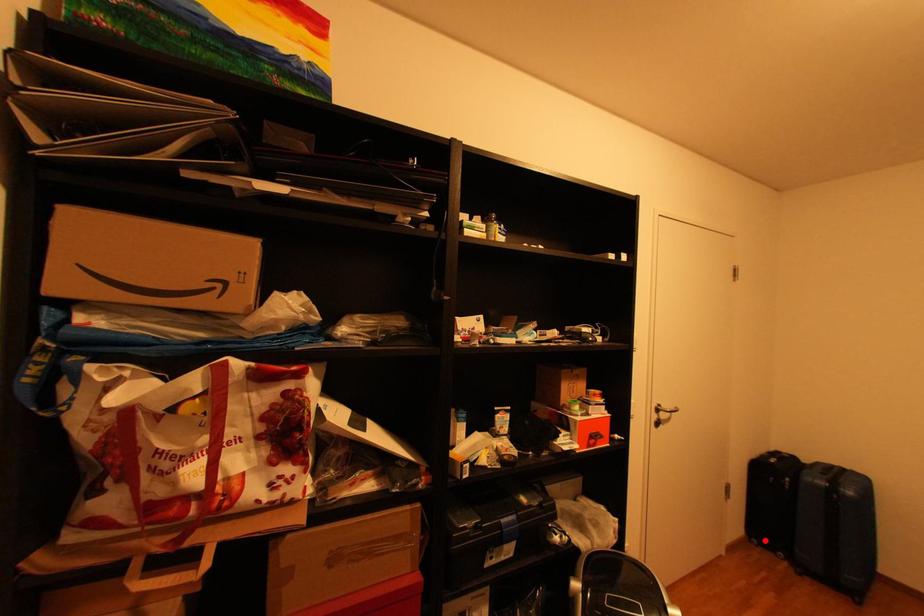
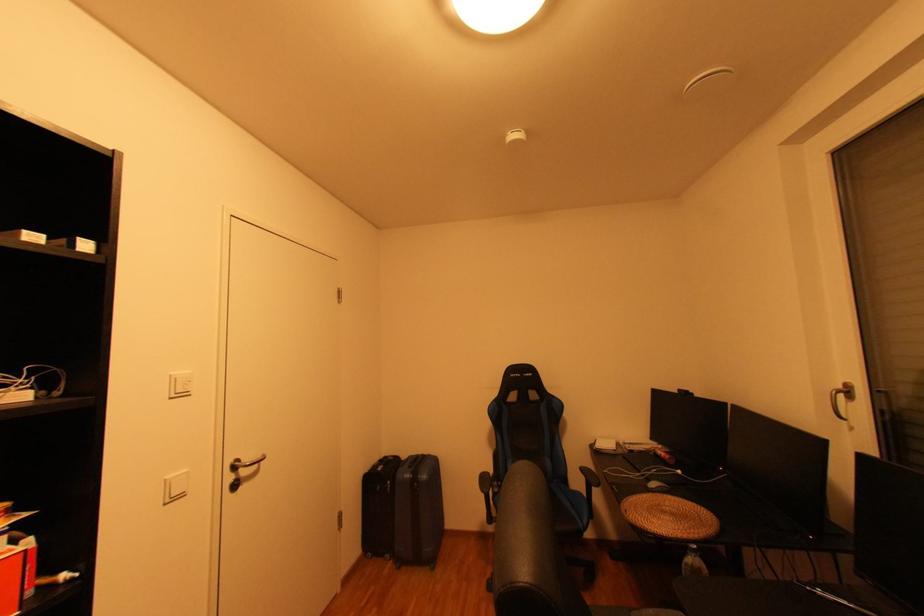
In the second image, find the point that corresponds to the highlighted location in the first image.

(380, 554)